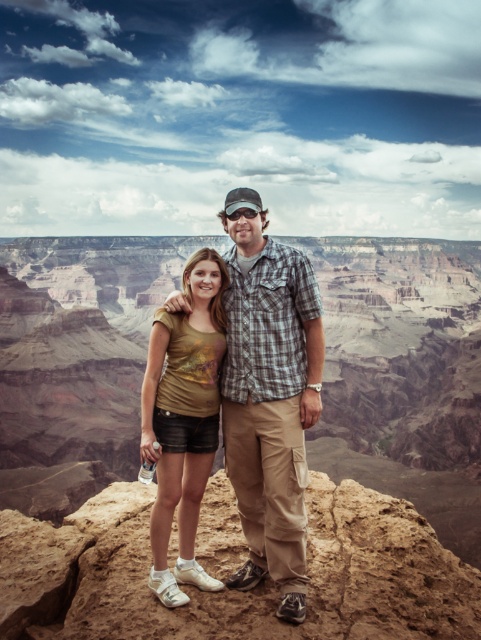
Question: Which object appears farthest from the camera in this image?

Choices:
 (A) gold metallic shirt at center
 (B) matte gold shirt at center

Answer: (A)

Question: Is matte gold shirt at center to the left of gold metallic shirt at center from the viewer's perspective?

Choices:
 (A) yes
 (B) no

Answer: (B)

Question: Among these objects, which one is nearest to the camera?

Choices:
 (A) gold metallic shirt at center
 (B) matte gold shirt at center

Answer: (B)

Question: Is matte gold shirt at center wider than gold metallic shirt at center?

Choices:
 (A) yes
 (B) no

Answer: (A)

Question: Is matte gold shirt at center smaller than gold metallic shirt at center?

Choices:
 (A) no
 (B) yes

Answer: (A)